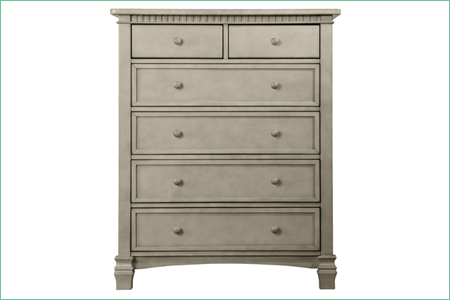
Locate an element on the screen. This screenshot has height=300, width=450. drawer with two knobs is located at coordinates (230, 88), (227, 129), (225, 186), (221, 234).